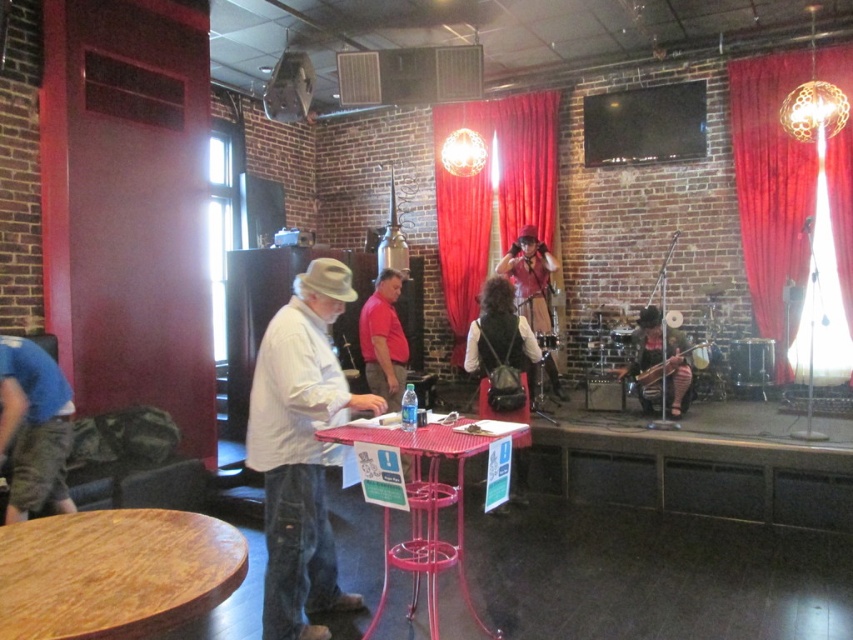
Question: Is white cotton shirt at center closer to the viewer compared to red velvet curtain at upper right?

Choices:
 (A) no
 (B) yes

Answer: (B)

Question: Which point appears closest to the camera in this image?

Choices:
 (A) (10, 541)
 (B) (706, 353)
 (C) (322, 605)

Answer: (A)

Question: Can you confirm if white cotton shirt at center is thinner than wooden table at lower left?

Choices:
 (A) no
 (B) yes

Answer: (B)

Question: Which point is closer to the camera taking this photo?

Choices:
 (A) (132, 525)
 (B) (466, 362)
 (C) (527, 170)
 (D) (302, 326)

Answer: (A)

Question: Is white cotton shirt at center to the left of wooden acoustic guitar at center from the viewer's perspective?

Choices:
 (A) yes
 (B) no

Answer: (A)

Question: Which object is farther from the camera taking this photo?

Choices:
 (A) white cotton shirt at center
 (B) metallic pink table at center
 (C) wooden drum at center

Answer: (C)